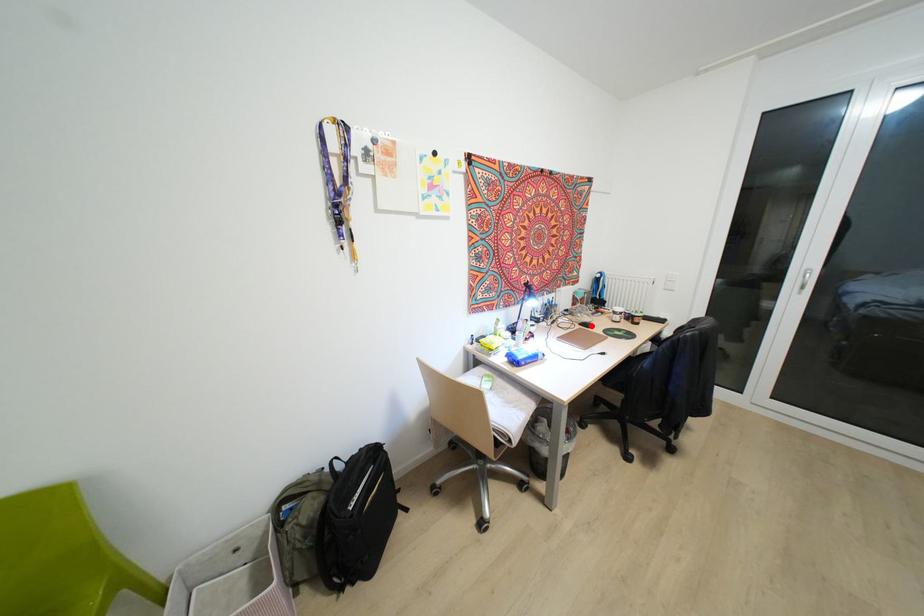
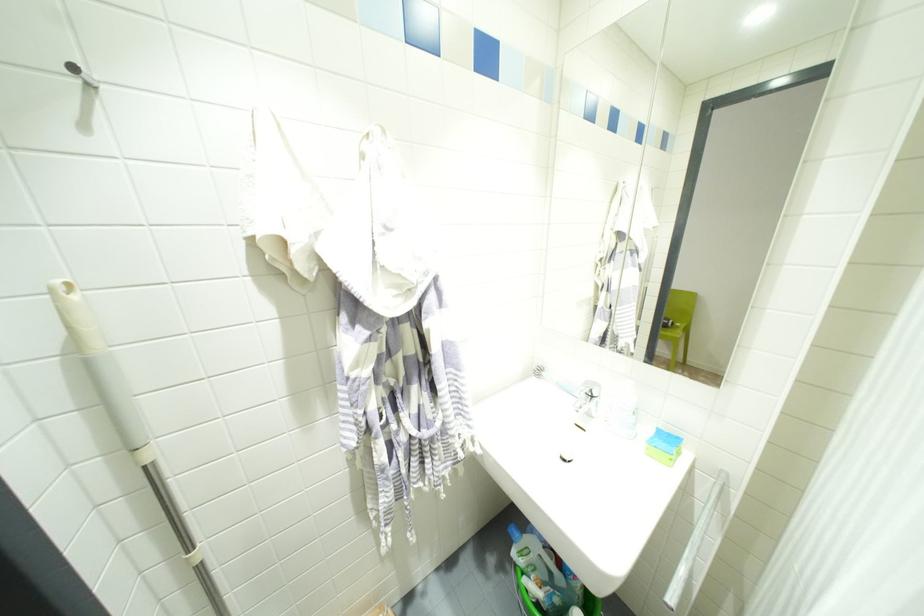
Question: I am providing you with two images of the same scene from different viewpoints. A red point is marked on the first image. Can you still see the location of the red point in image 2?

Choices:
 (A) Yes
 (B) No

Answer: (B)